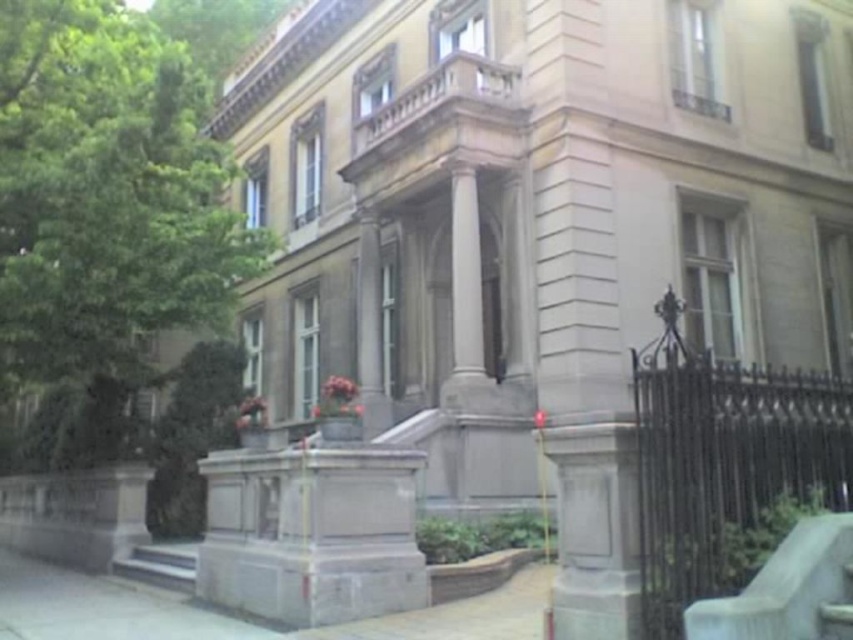
You are standing at the bottom of the smooth concrete stairs at lower left and want to walk towards the white marble column at center. In which direction should you move?

You should move to the right because the white marble column at center is to the right of the smooth concrete stairs at lower left.

You are standing in front of the grand classical building and want to take a photo that includes the green leafy tree at upper left. Based on its position, where should you position yourself to ensure the tree is in the frame?

To include the green leafy tree at upper left in your photo, position yourself so the tree is near the upper left corner of the frame, as its 2D location is at point (223, 29), which places it in the upper left area of the image.

You are standing in front of the grand classical building. There is a white marble column at center marked by point [466,300]. If you want to walk towards the column, which direction should you move from your current position?

The white marble column at center is located at point [466,300]. Since you are facing the building, you should move straight ahead towards the center to reach the column.